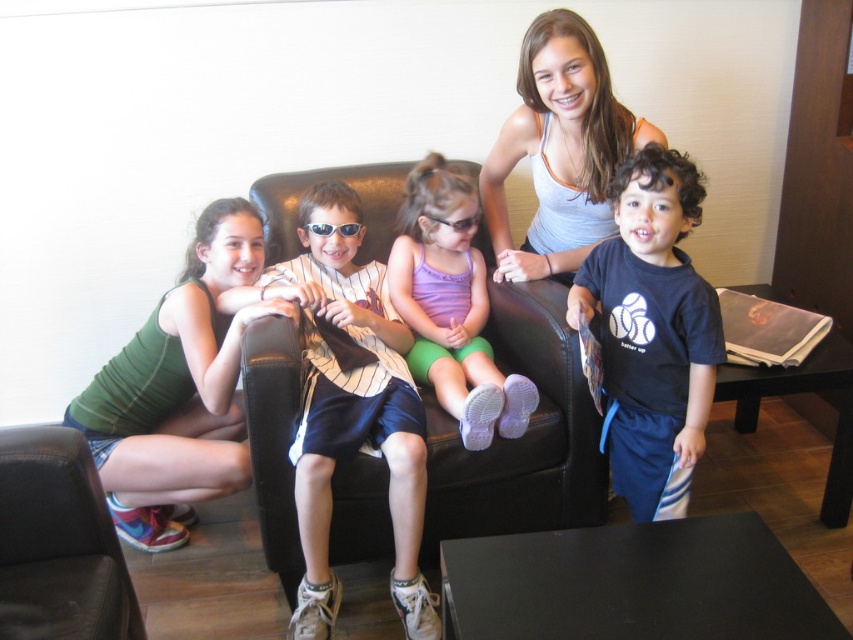
Based on the photo, who is taller, black matte shirt at center or black plastic sunglasses at center?

black matte shirt at center is taller.

Which is in front, point (601, 256) or point (349, 224)?

Point (601, 256) is more forward.

Does point (688, 372) come closer to viewer compared to point (323, 224)?

Yes, it is in front of point (323, 224).

This screenshot has width=853, height=640. Identify the location of black matte shirt at center. (653, 332).

Can you confirm if green fabric tank top at lower left is positioned to the right of black matte shirt at center?

No, green fabric tank top at lower left is not to the right of black matte shirt at center.

Which is behind, point (236, 454) or point (645, 480)?

The point (236, 454) is behind.

The height and width of the screenshot is (640, 853). I want to click on green fabric tank top at lower left, so click(177, 390).

Is point (210, 260) closer to camera compared to point (440, 230)?

Yes, it is.

Can you confirm if green fabric tank top at lower left is bigger than purple fabric shorts at center?

Correct, green fabric tank top at lower left is larger in size than purple fabric shorts at center.

The image size is (853, 640). In order to click on green fabric tank top at lower left in this screenshot , I will do `click(177, 390)`.

Locate an element on the screen. green fabric tank top at lower left is located at coordinates (177, 390).